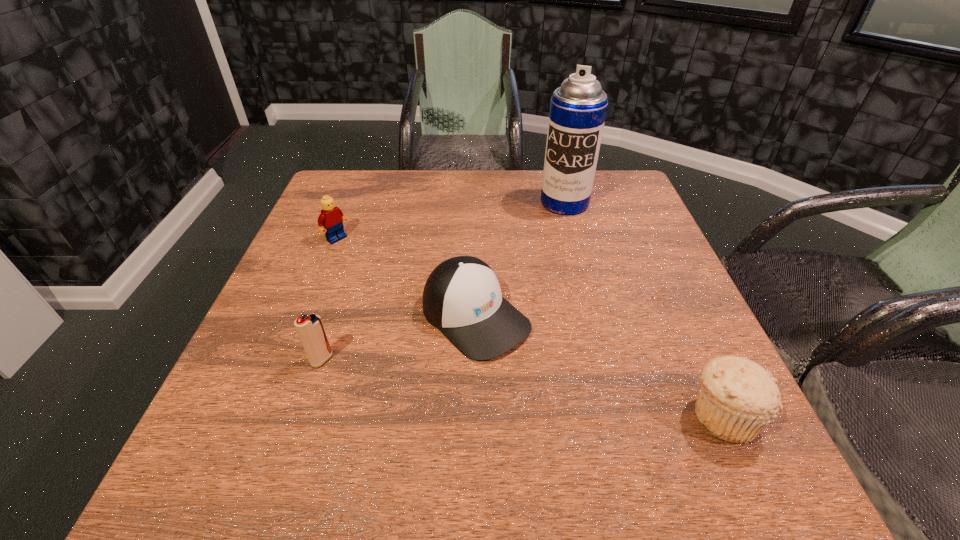
Find the location of a particular element. The height and width of the screenshot is (540, 960). free spot between the nearest object and the second object from right to left is located at coordinates click(x=643, y=309).

Where is `free space between the third object from left to right and the Lego`? free space between the third object from left to right and the Lego is located at coordinates tap(406, 278).

Identify which object is located as the third nearest to the farthest object. Please provide its 2D coordinates. Your answer should be formatted as a tuple, i.e. [(x, y)], where the tuple contains the x and y coordinates of a point satisfying the conditions above.

[(738, 399)]

Locate an element on the screen. The width and height of the screenshot is (960, 540). the closest object to the farthest object is located at coordinates (462, 298).

Where is `free space in the image that satisfies the following two spatial constraints: 1. on the back side of the igniter; 2. on the left side of the aerosol can`? This screenshot has width=960, height=540. free space in the image that satisfies the following two spatial constraints: 1. on the back side of the igniter; 2. on the left side of the aerosol can is located at coordinates (373, 202).

The width and height of the screenshot is (960, 540). Identify the location of free space that satisfies the following two spatial constraints: 1. on the front side of the second farthest object; 2. on the right side of the nearest object. (267, 415).

In order to click on vacant point that satisfies the following two spatial constraints: 1. on the back side of the farthest object; 2. on the right side of the third object from right to left in this screenshot , I will do `click(477, 202)`.